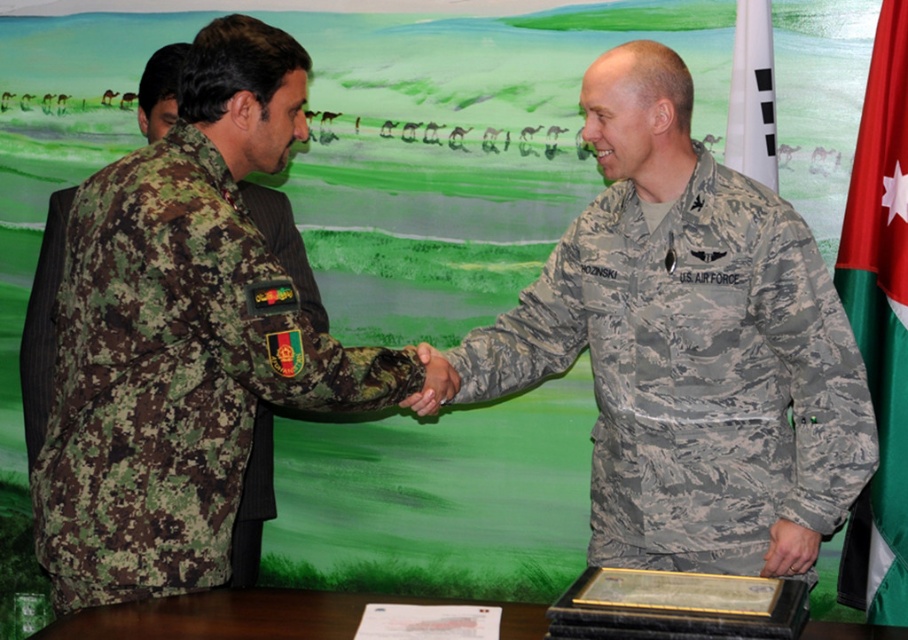
Is green fabric flag at right taller than white fabric flag at upper right?

Correct, green fabric flag at right is much taller as white fabric flag at upper right.

Which is behind, point (861, 180) or point (747, 42)?

Point (747, 42)

Does point (894, 212) come behind point (751, 104)?

That is False.

Identify the location of green fabric flag at right. (879, 323).

Between camouflage fabric us air force uniform at center and camouflage fabric uniform at left, which one is positioned higher?

camouflage fabric us air force uniform at center

Can you confirm if camouflage fabric us air force uniform at center is taller than camouflage fabric uniform at left?

Yes, camouflage fabric us air force uniform at center is taller than camouflage fabric uniform at left.

Is point (847, 352) positioned before point (61, 426)?

No, (847, 352) is further to viewer.

Image resolution: width=908 pixels, height=640 pixels. Identify the location of camouflage fabric us air force uniform at center. (693, 372).

Measure the distance between point (126, 532) and camera.

Point (126, 532) and camera are 1.63 meters apart from each other.

Is point (398, 387) positioned in front of point (753, 132)?

Yes.

Identify the location of camouflage fabric uniform at left. The width and height of the screenshot is (908, 640). point(173,376).

Identify the location of camouflage fabric uniform at left. This screenshot has height=640, width=908. (173, 376).